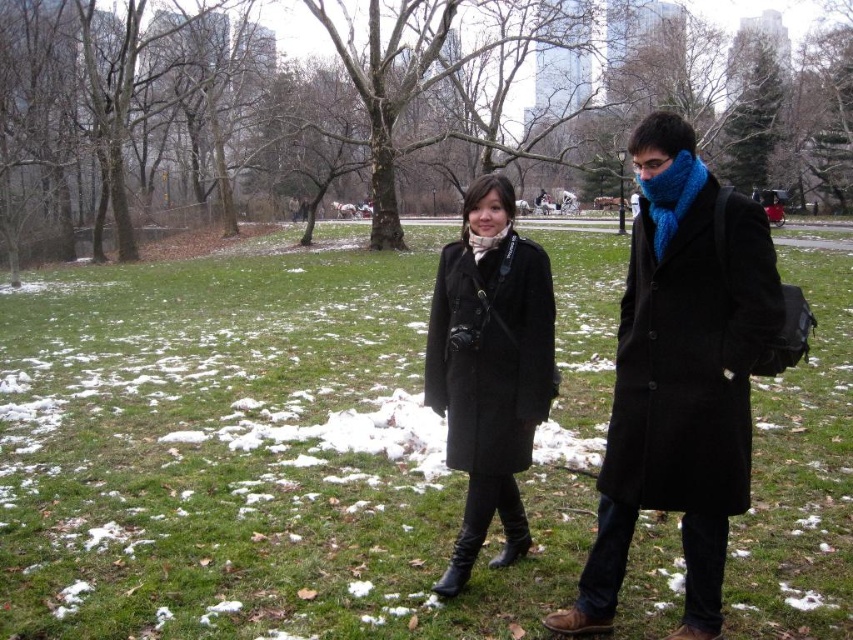
Question: Observing the image, what is the correct spatial positioning of black wool coat at center in reference to blue knitted scarf at center?

Choices:
 (A) below
 (B) above

Answer: (A)

Question: Is black wool coat at center positioned at the back of blue knitted scarf at center?

Choices:
 (A) no
 (B) yes

Answer: (A)

Question: Does black wool coat at right appear over blue knitted scarf at center?

Choices:
 (A) yes
 (B) no

Answer: (B)

Question: Which of the following is the farthest from the observer?

Choices:
 (A) black wool coat at right
 (B) black wool coat at center
 (C) blue knitted scarf at right
 (D) green grass at center

Answer: (B)

Question: Which of the following is the closest to the observer?

Choices:
 (A) (677, 156)
 (B) (467, 234)
 (C) (306, 285)

Answer: (A)

Question: Estimate the real-world distances between objects in this image. Which object is closer to the blue knitted scarf at center?

Choices:
 (A) black wool coat at right
 (B) green grass at center

Answer: (A)